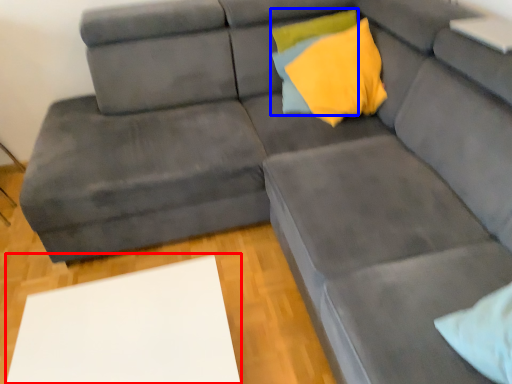
Question: Which point is further to the camera, table (highlighted by a red box) or pillow (highlighted by a blue box)?

Choices:
 (A) table
 (B) pillow

Answer: (B)